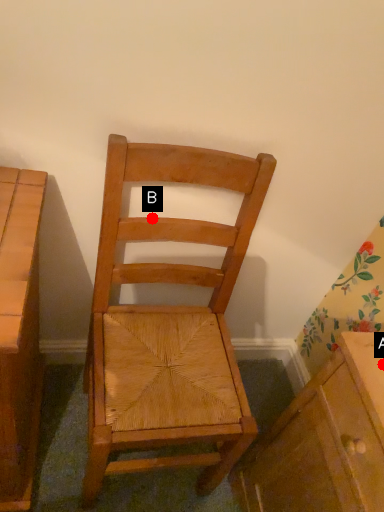
Question: Two points are circled on the image, labeled by A and B beside each circle. Which point is closer to the camera taking this photo?

Choices:
 (A) A is closer
 (B) B is closer

Answer: (A)